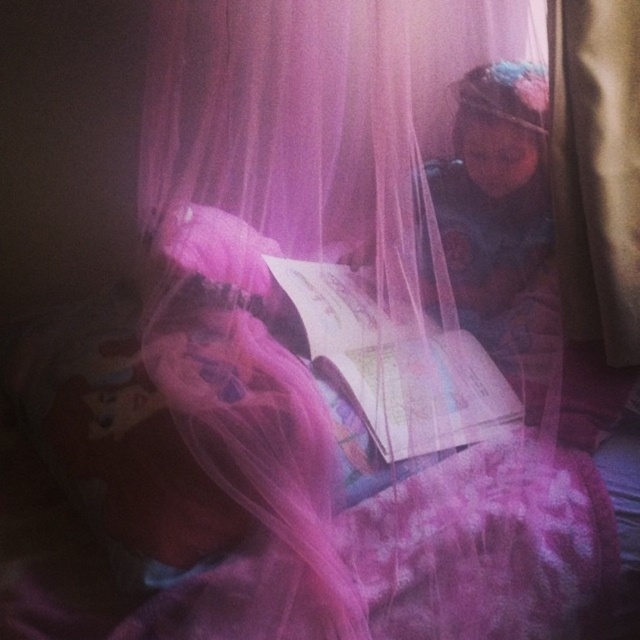
Does brown fabric curtain at right appear on the right side of matte paper book at center?

Correct, you'll find brown fabric curtain at right to the right of matte paper book at center.

Does brown fabric curtain at right come behind matte paper book at center?

Yes, brown fabric curtain at right is behind matte paper book at center.

Locate an element on the screen. The width and height of the screenshot is (640, 640). brown fabric curtain at right is located at coordinates (596, 168).